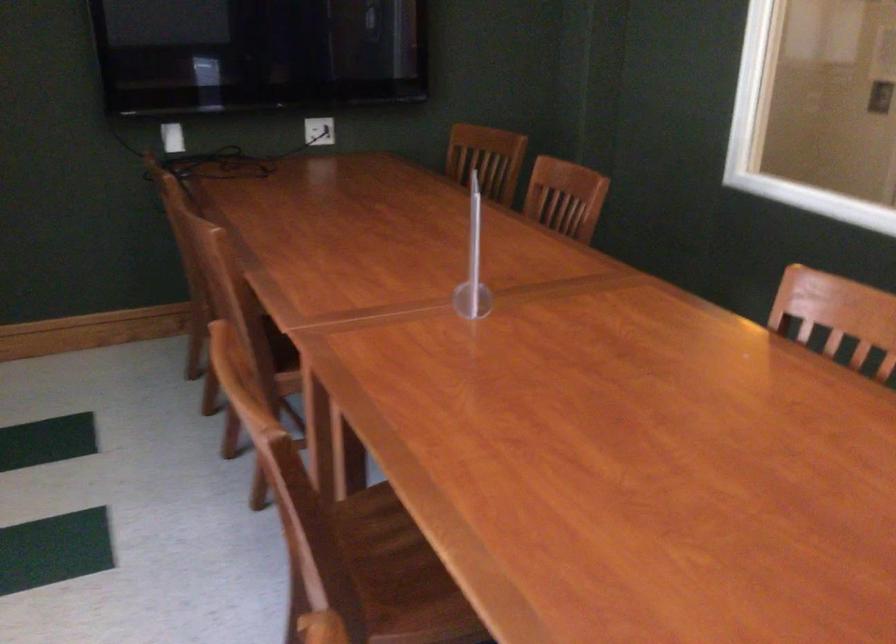
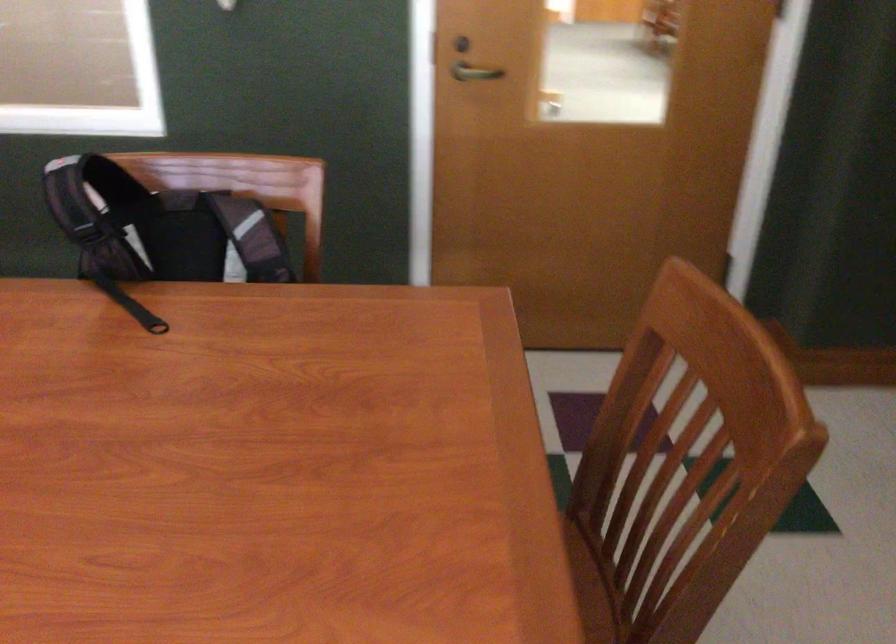
The images are taken continuously from a first-person perspective. In which direction is your viewpoint rotating?

The camera rotated toward right-down.